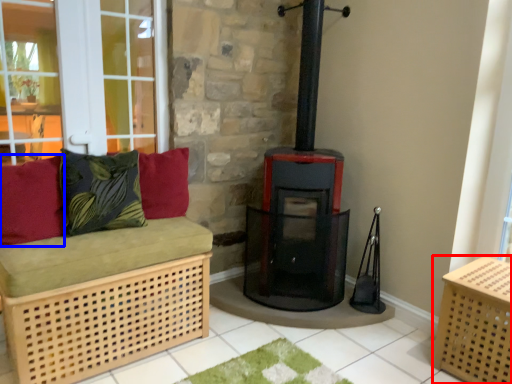
Question: Which object is closer to the camera taking this photo, crate (highlighted by a red box) or pillow (highlighted by a blue box)?

Choices:
 (A) crate
 (B) pillow

Answer: (A)